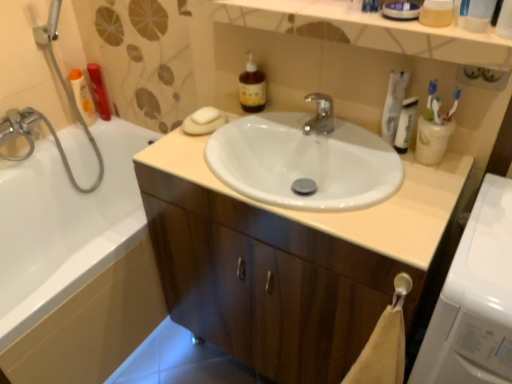
Where is `vacant area in front of translucent amber liquid at upper center`? This screenshot has height=384, width=512. vacant area in front of translucent amber liquid at upper center is located at coordinates (247, 133).